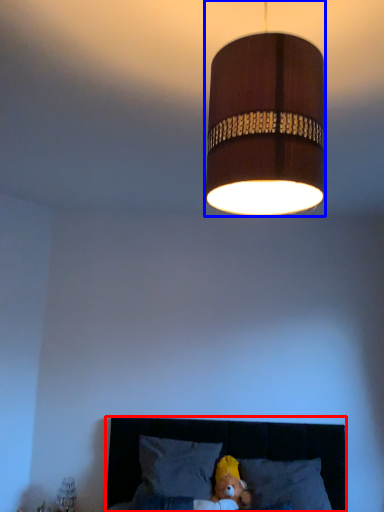
Question: Which point is closer to the camera, furniture (highlighted by a red box) or lamp (highlighted by a blue box)?

Choices:
 (A) furniture
 (B) lamp

Answer: (B)